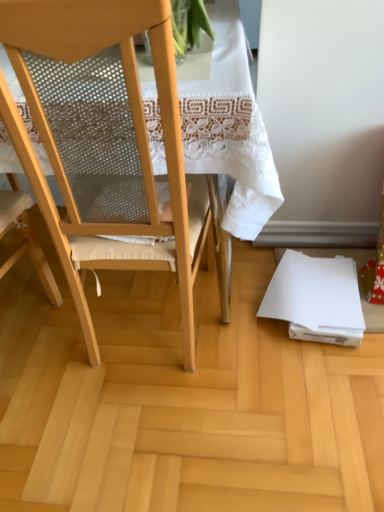
Identify the location of free space in front of white paper at lower right. Image resolution: width=384 pixels, height=512 pixels. (312, 385).